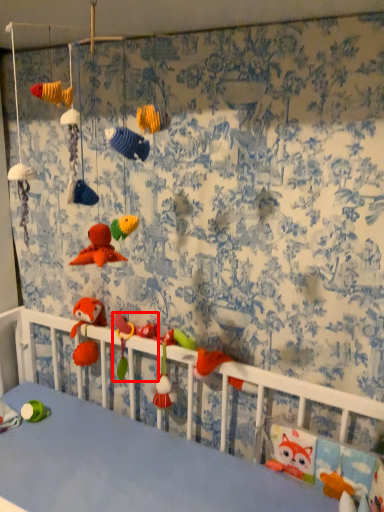
Question: Where is toy (annotated by the red box) located in relation to toy in the image?

Choices:
 (A) right
 (B) left

Answer: (A)